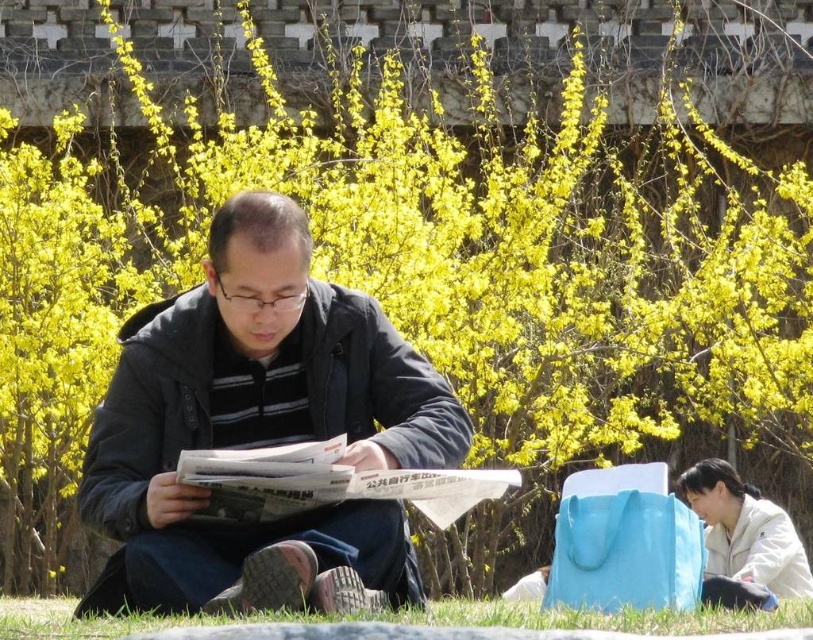
Question: Which point appears farthest from the camera in this image?

Choices:
 (A) (229, 481)
 (B) (161, 592)
 (C) (746, 611)

Answer: (C)

Question: Observing the image, what is the correct spatial positioning of white glossy newspaper at center in reference to green grass at lower center?

Choices:
 (A) right
 (B) left

Answer: (A)

Question: Does white glossy newspaper at center have a greater width compared to green grass at lower center?

Choices:
 (A) no
 (B) yes

Answer: (A)

Question: Does white glossy newspaper at center have a larger size compared to green grass at lower center?

Choices:
 (A) yes
 (B) no

Answer: (B)

Question: Which of these objects is positioned closest to the green grass at lower center?

Choices:
 (A) white glossy newspaper at center
 (B) dark blue jacket at center

Answer: (A)

Question: Considering the real-world distances, which object is closest to the dark blue jacket at center?

Choices:
 (A) white glossy newspaper at center
 (B) green grass at lower center

Answer: (A)